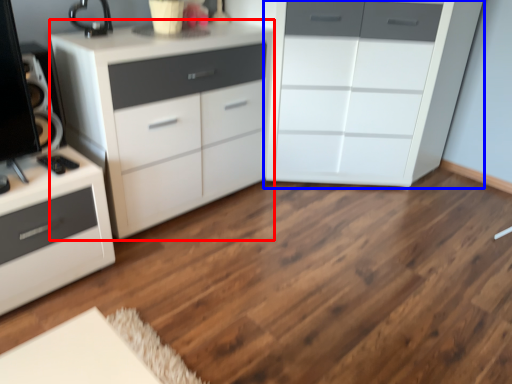
Question: Which of the following is the farthest to the observer, chest of drawers (highlighted by a red box) or chest of drawers (highlighted by a blue box)?

Choices:
 (A) chest of drawers
 (B) chest of drawers

Answer: (B)